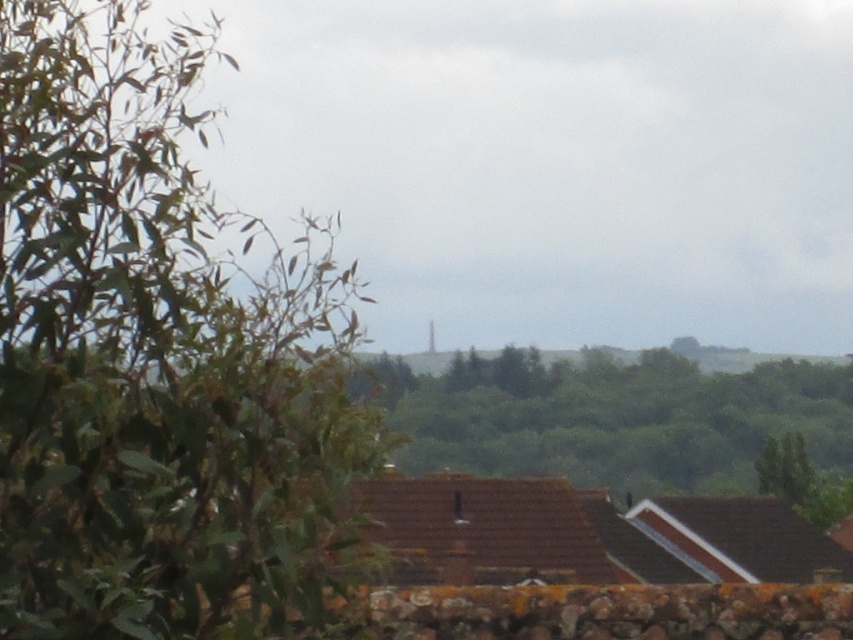
Is green leafy tree at center smaller than green leafy tree at lower right?

No.

Between point (523, 440) and point (802, 451), which one is positioned behind?

Positioned behind is point (523, 440).

Find the location of a particular element. green leafy tree at center is located at coordinates pyautogui.click(x=613, y=419).

Is green leafy tree at left wider than green leafy tree at lower right?

Indeed, green leafy tree at left has a greater width compared to green leafy tree at lower right.

Who is positioned more to the left, green leafy tree at left or green leafy tree at lower right?

green leafy tree at left

At what (x,y) coordinates should I click in order to perform the action: click on green leafy tree at left. Please return your answer as a coordinate pair (x, y). The width and height of the screenshot is (853, 640). Looking at the image, I should click on (155, 360).

Identify the location of green leafy tree at left. (155, 360).

Is green leafy tree at left in front of green leafy tree at center?

Yes.

Who is more forward, (26,547) or (453,448)?

Positioned in front is point (26,547).

The height and width of the screenshot is (640, 853). Describe the element at coordinates (155, 360) in the screenshot. I see `green leafy tree at left` at that location.

Image resolution: width=853 pixels, height=640 pixels. What are the coordinates of `green leafy tree at left` in the screenshot? It's located at (155, 360).